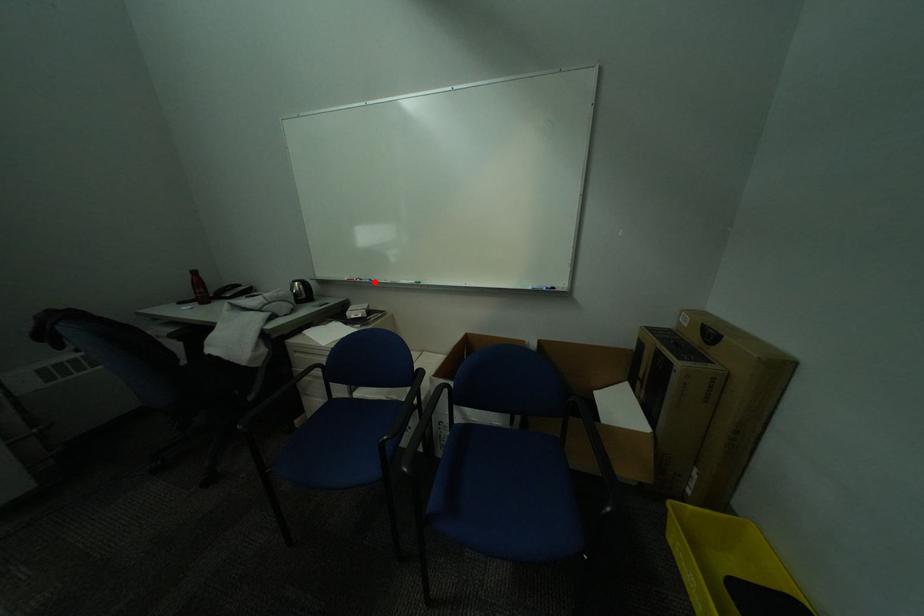
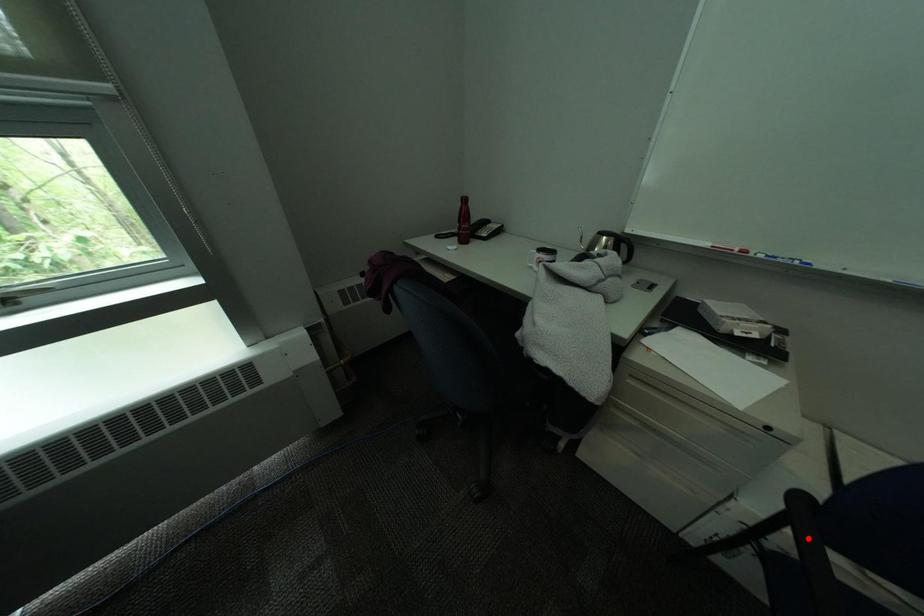
Based on the photo, I am providing you with two images of the same scene from different viewpoints. A red point is marked on the first image and another point is marked on the second image. Is the marked point in image1 the same physical position as the marked point in image2?

No